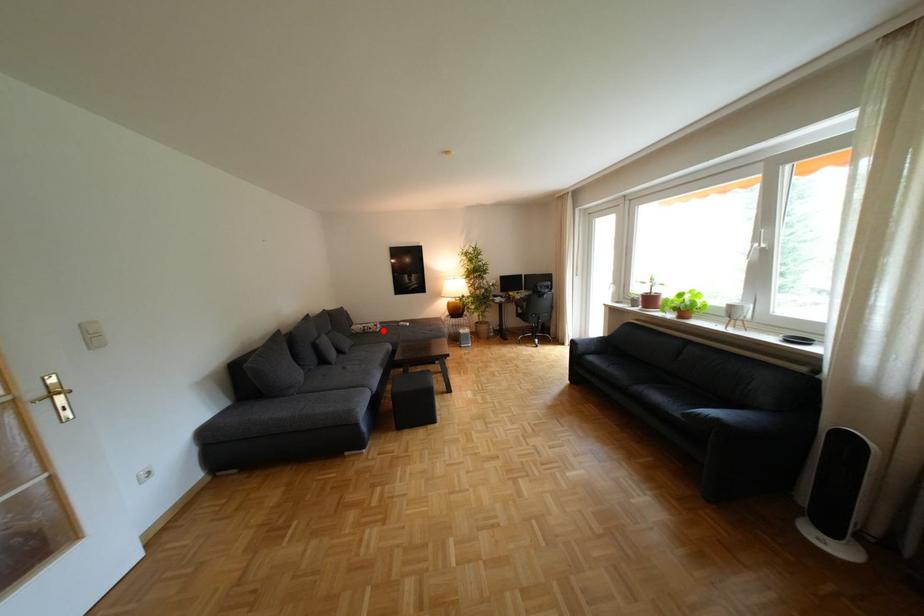
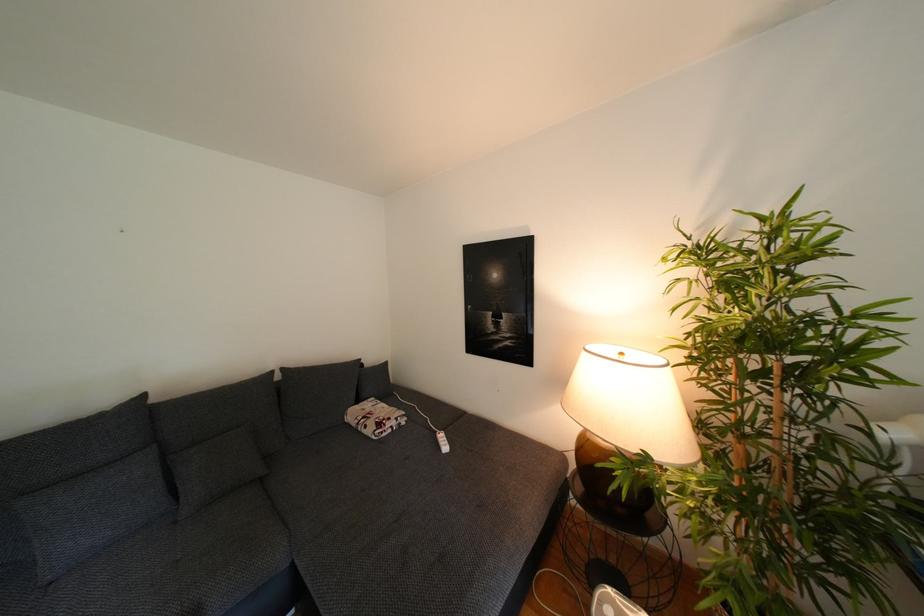
Where in the second image is the point corresponding to the highlighted location from the first image?

(378, 431)